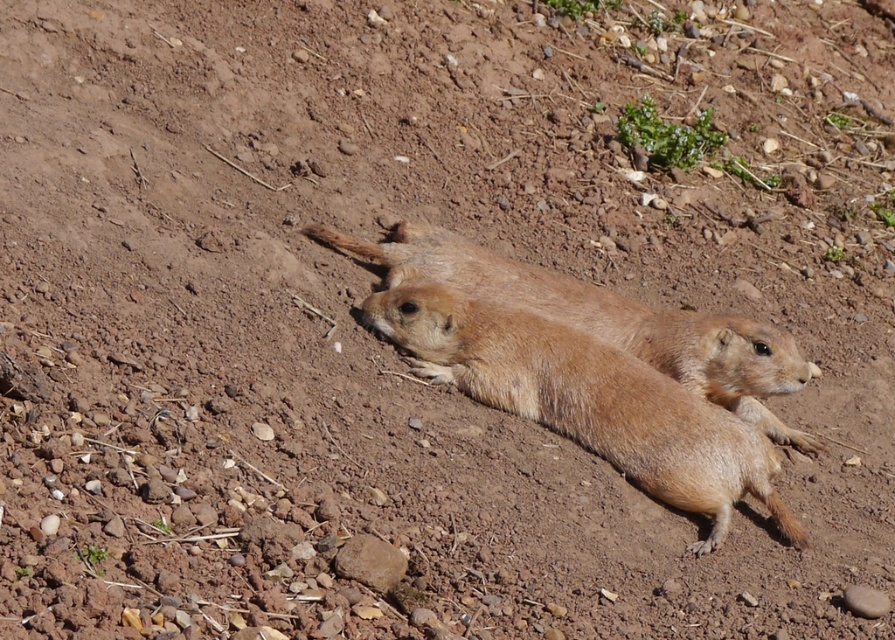
You are a photographer trying to capture the prairie dogs in the image. You want to ensure that your focus point lands exactly at the point labeled as point (587, 400). Based on the scene description, where should you aim your camera focus point?

The point (587, 400) is located on the furry golden ground squirrel at center, so you should aim your camera focus point at the furry golden ground squirrel at center to capture it clearly.

You are a prairie dog exploring the terrain. You see two points marked on the ground. The first point is at location point (440,369) and the second is at point (680,364). If you want to reach the point that is closer to you, which one should you go to?

Point (440,369) is in front of point (680,364), so you should go to point (440,369) because it is closer to you.

You are a photographer trying to capture both the furry golden ground squirrel at center and the brown furry ground squirrel at center in a single shot. Which squirrel will appear smaller in the photo?

The furry golden ground squirrel at center will appear smaller because it is positioned under the brown furry ground squirrel at center, making it farther away from the camera.